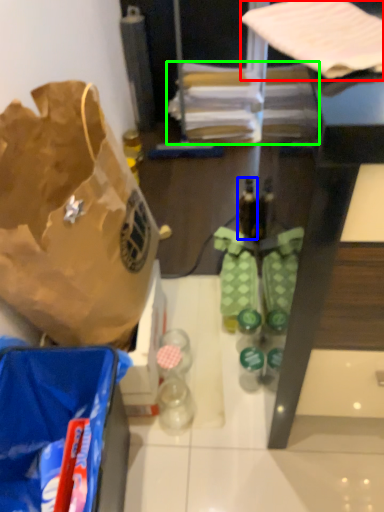
Question: Which is nearer to the wrapping paper (highlighted by a red box)? bottle (highlighted by a blue box) or wrapping paper (highlighted by a green box).

Choices:
 (A) bottle
 (B) wrapping paper

Answer: (A)